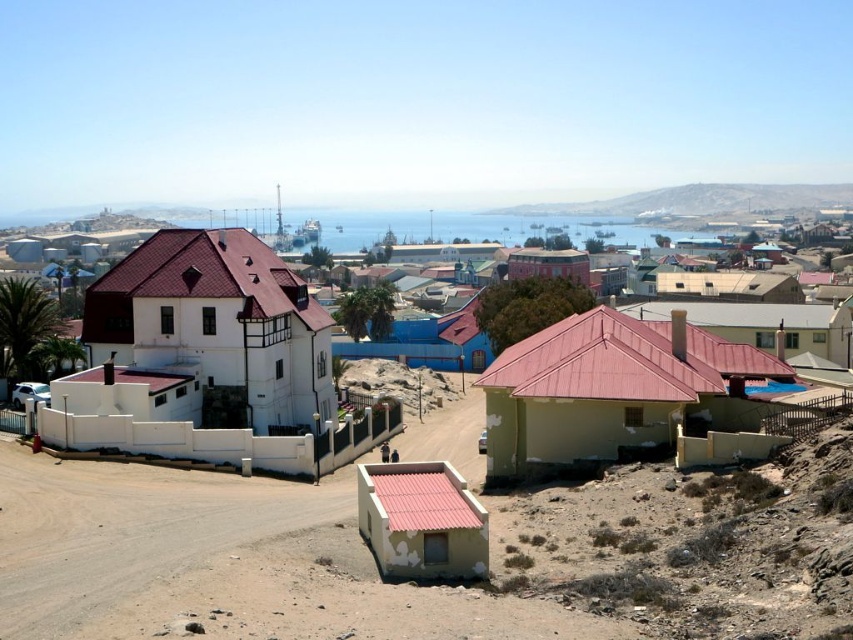
You are a tourist standing at the entrance of the coastal town and see the yellow matte house at lower right and the light beige corrugated metal hut at lower center. Which of these two buildings is positioned farther to the right from your viewpoint?

The yellow matte house at lower right is positioned farther to the right from your viewpoint compared to the light beige corrugated metal hut at lower center.

You are a tourist in the coastal town and want to take a photo of both the white matte house at center and the white matte house at left. Which one should you stand closer to in order to capture both in a single frame?

You should stand closer to the white matte house at left because it is smaller, allowing you to include both the white matte house at center and the white matte house at left in the same frame.